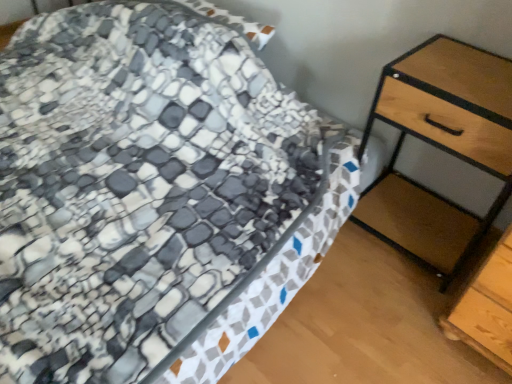
Locate an element on the screen. free space above wooden chest of drawers at right (from a real-world perspective) is located at coordinates (466, 76).